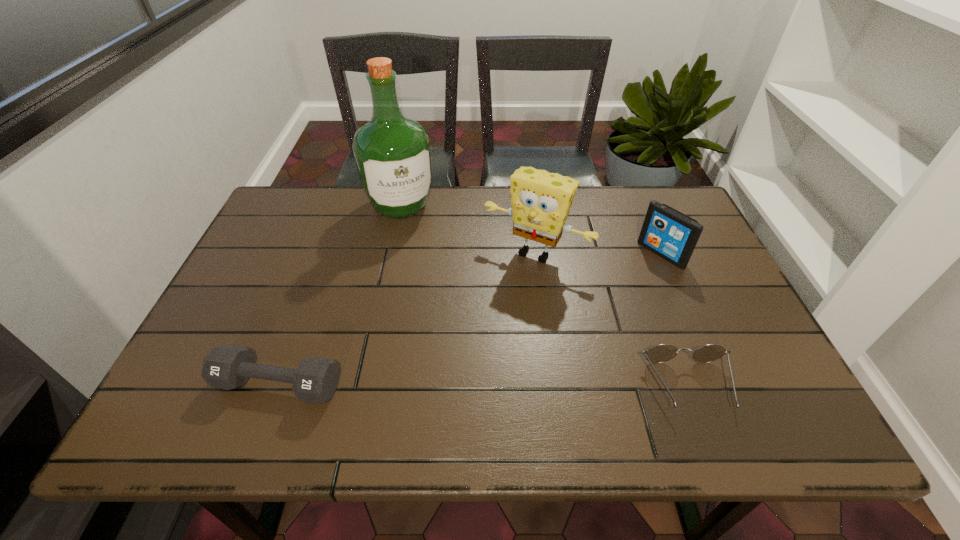
I want to click on vacant space that's between the iPod and the fourth shortest object, so pos(598,253).

The image size is (960, 540). Identify the location of free point between the sponge and the fourth tallest object. (407, 319).

This screenshot has height=540, width=960. Identify the location of vacant point located between the dumbbell and the sponge. (407, 319).

Locate an element on the screen. Image resolution: width=960 pixels, height=540 pixels. unoccupied area between the second tallest object and the shortest object is located at coordinates (612, 320).

I want to click on free space between the spectacles and the fourth shortest object, so click(x=612, y=320).

Where is `free space between the farthest object and the fourth shortest object`? free space between the farthest object and the fourth shortest object is located at coordinates (468, 230).

Find the location of `free space between the fourth tallest object and the fourth shortest object`. free space between the fourth tallest object and the fourth shortest object is located at coordinates (407, 319).

Locate an element on the screen. The image size is (960, 540). unoccupied position between the shortest object and the iPod is located at coordinates 675,320.

Where is `free space between the second shortest object and the iPod`? free space between the second shortest object and the iPod is located at coordinates (470, 319).

Where is `object that stands as the closest to the fourth shortest object`? This screenshot has height=540, width=960. object that stands as the closest to the fourth shortest object is located at coordinates (672, 235).